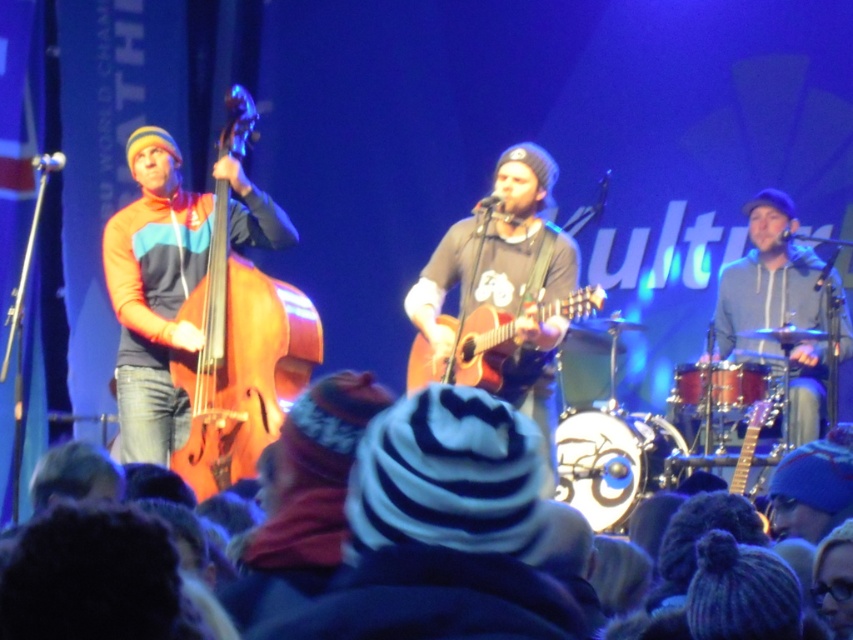
You are a photographer standing at the front of the stage. You want to take a closeup shot of the double bass at left. Which part of the double bass at left is exactly at the point with coordinates (238, 362)?

The point with coordinates (238, 362) is on the wooden polished cello at left, which is part of the double bass at left.

You are a stagehand setting up a new microphone stand. The stand needs to be placed between the wooden polished cello at left and the matte brown acoustic guitar at center. Since the stand is 10 cm wide, will there be enough space between the two instruments?

The wooden polished cello at left is thinner than the matte brown acoustic guitar at center, so the space between them is sufficient to accommodate the 10 cm wide microphone stand.